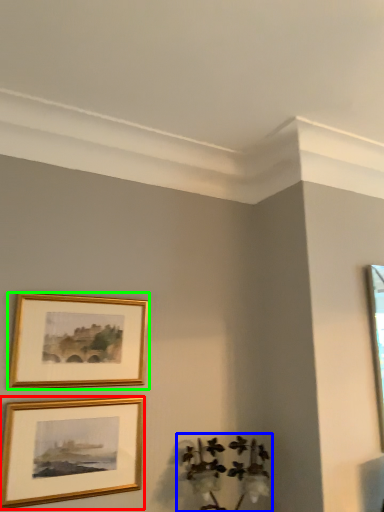
Question: Which is farther away from picture frame (highlighted by a red box)? plant (highlighted by a blue box) or picture frame (highlighted by a green box)?

Choices:
 (A) plant
 (B) picture frame

Answer: (A)